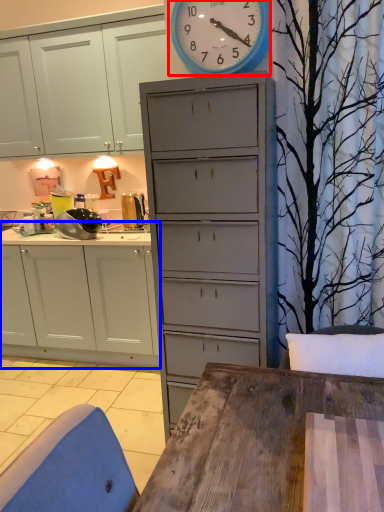
Question: Which object appears farthest to the camera in this image, wall clock (highlighted by a red box) or cabinetry (highlighted by a blue box)?

Choices:
 (A) wall clock
 (B) cabinetry

Answer: (B)